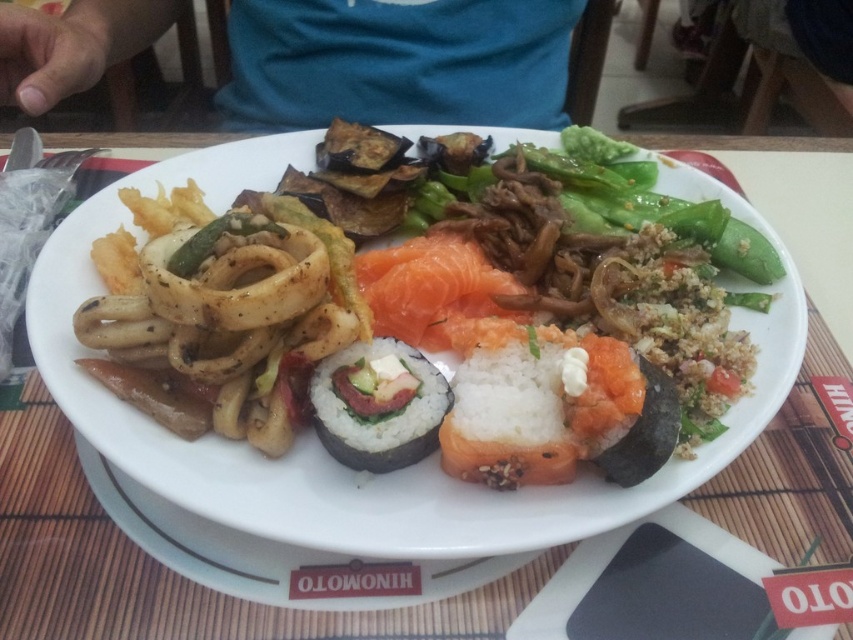
Question: Considering the real-world distances, which object is farthest from the white glossy plate at center?

Choices:
 (A) green leafy vegetable at center
 (B) pink raw salmon at center

Answer: (A)

Question: Which of these objects is positioned farthest from the pink raw salmon at center?

Choices:
 (A) white glossy plate at center
 (B) green leafy vegetable at center

Answer: (B)

Question: Which of the following is the farthest from the observer?

Choices:
 (A) (386, 323)
 (B) (383, 493)

Answer: (A)

Question: Is green leafy vegetable at center above sushi at center?

Choices:
 (A) no
 (B) yes

Answer: (B)

Question: Can you confirm if white glossy plate at center is positioned to the left of sushi at center?

Choices:
 (A) no
 (B) yes

Answer: (A)

Question: Does white glossy plate at center appear over green leafy vegetable at center?

Choices:
 (A) no
 (B) yes

Answer: (A)